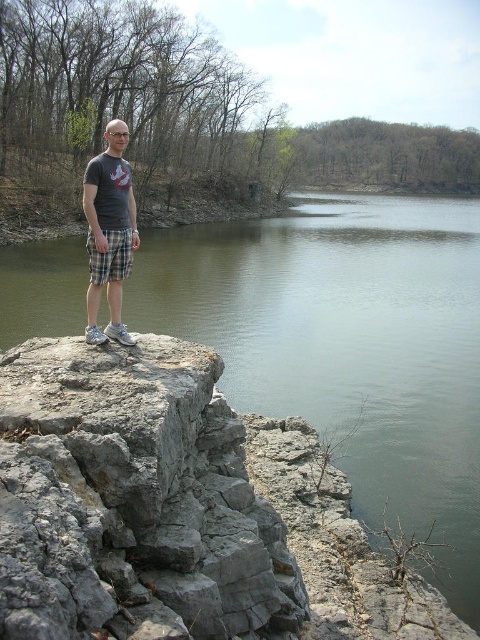
Does gray rough rock at center have a greater width compared to matte gray t-shirt at center?

Indeed, gray rough rock at center has a greater width compared to matte gray t-shirt at center.

Is gray rough rock at center below matte gray t-shirt at center?

Yes.

The height and width of the screenshot is (640, 480). I want to click on gray rough rock at center, so click(x=132, y=500).

Is greenish-gray water at center shorter than gray rough rock at center?

In fact, greenish-gray water at center may be taller than gray rough rock at center.

Between greenish-gray water at center and gray rough rock at center, which one has more height?

With more height is greenish-gray water at center.

Is point (379, 227) farther from viewer compared to point (208, 524)?

Yes, it is.

Locate an element on the screen. greenish-gray water at center is located at coordinates (348, 342).

Does point (407, 204) come closer to viewer compared to point (115, 131)?

No, it is not.

Identify the location of greenish-gray water at center. (348, 342).